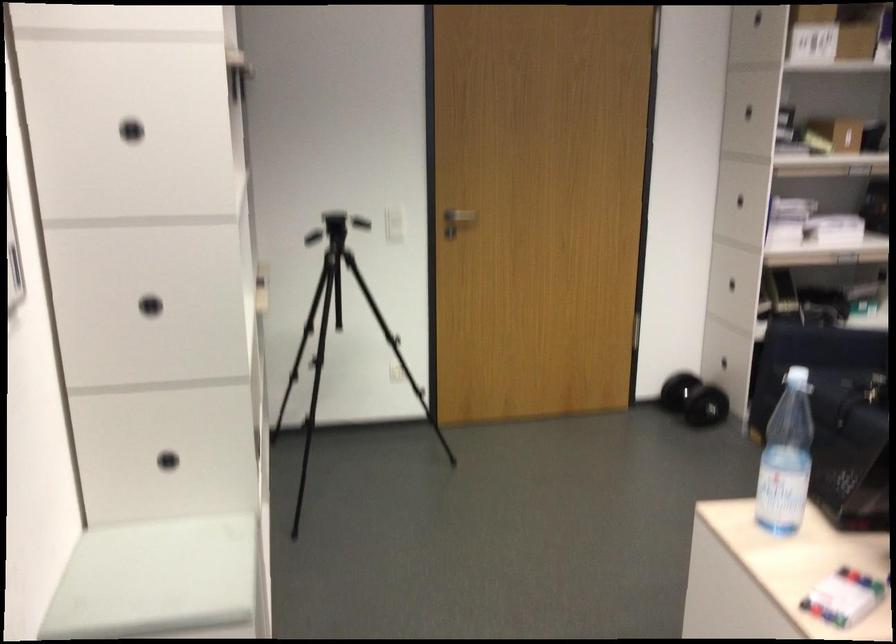
What do you see at coordinates (339, 334) in the screenshot? I see `the black camera tripod` at bounding box center [339, 334].